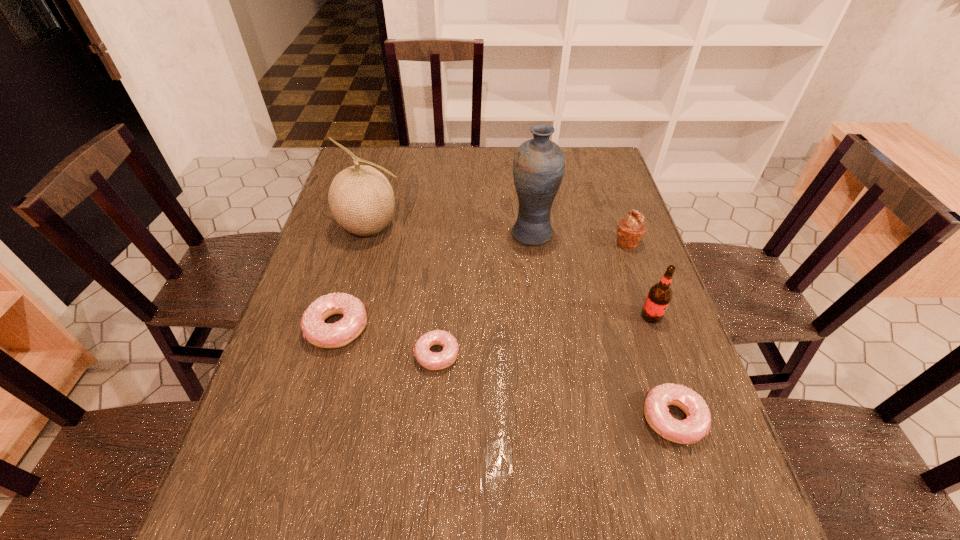
Find the location of a particular element. the tallest doughnut is located at coordinates (338, 334).

At what (x,y) coordinates should I click in order to perform the action: click on the leftmost doughnut. Please return your answer as a coordinate pair (x, y). This screenshot has height=540, width=960. Looking at the image, I should click on (338, 334).

What are the coordinates of `the second doughnut from right to left` in the screenshot? It's located at (433, 361).

Identify the location of the shortest doughnut. click(x=433, y=361).

This screenshot has width=960, height=540. I want to click on the sixth tallest object, so click(697, 424).

The image size is (960, 540). I want to click on the nearest doughnut, so click(697, 424).

At what (x,y) coordinates should I click in order to perform the action: click on the sixth shortest object. Please return your answer as a coordinate pair (x, y). Looking at the image, I should click on (361, 199).

In order to click on the fourth object from right to left in this screenshot , I will do `click(538, 167)`.

The image size is (960, 540). What are the coordinates of `the tallest object` in the screenshot? It's located at (538, 167).

Image resolution: width=960 pixels, height=540 pixels. Find the location of `muffin`. muffin is located at coordinates (631, 230).